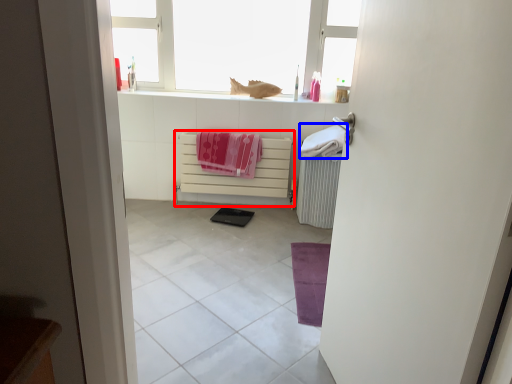
Question: Which point is further to the camera, cabinetry (highlighted by a red box) or beach towel (highlighted by a blue box)?

Choices:
 (A) cabinetry
 (B) beach towel

Answer: (A)